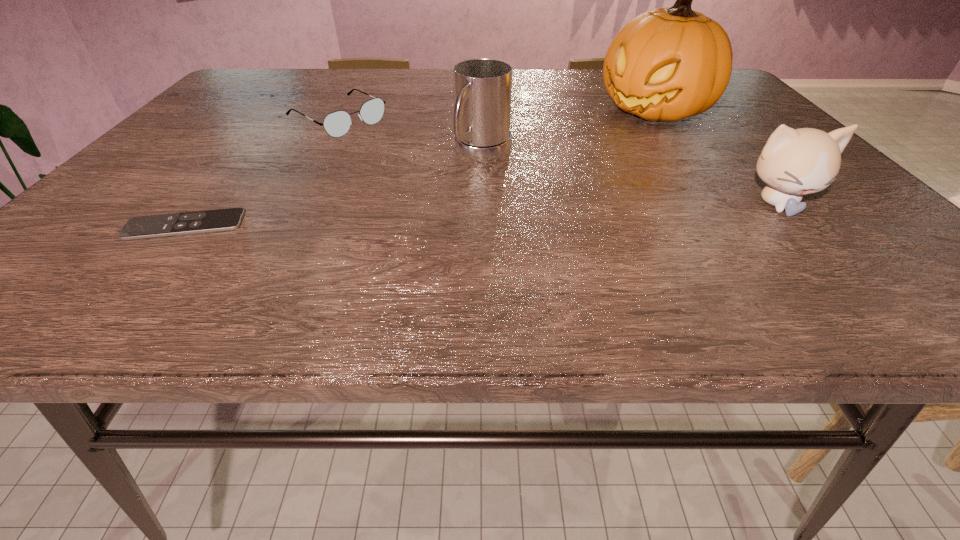
Identify the location of remote control. 162,225.

I want to click on kitten, so coord(794,162).

You are a GUI agent. You are given a task and a screenshot of the screen. Output one action in this format:
    pyautogui.click(x=<x>, y=<y>)
    Task: Click on the tallest object
    This screenshot has height=540, width=960.
    Given the screenshot: What is the action you would take?
    pyautogui.click(x=667, y=64)

Identify the location of mug. (482, 87).

Locate an element on the screen. spectacles is located at coordinates tap(336, 124).

Where is `vacant space located 0.260m on the right of the shortest object`? This screenshot has height=540, width=960. vacant space located 0.260m on the right of the shortest object is located at coordinates (385, 226).

Image resolution: width=960 pixels, height=540 pixels. In order to click on blank space located on the face of the kitten in this screenshot , I will do `click(815, 247)`.

Find the location of a particular element. This screenshot has width=960, height=540. free space located on the front face of the pumpkin is located at coordinates point(607,137).

Find the location of `free space located 0.400m on the front face of the pumpkin`. free space located 0.400m on the front face of the pumpkin is located at coordinates (514, 189).

Locate an element on the screen. The width and height of the screenshot is (960, 540). vacant space located 0.210m on the front face of the pumpkin is located at coordinates (571, 157).